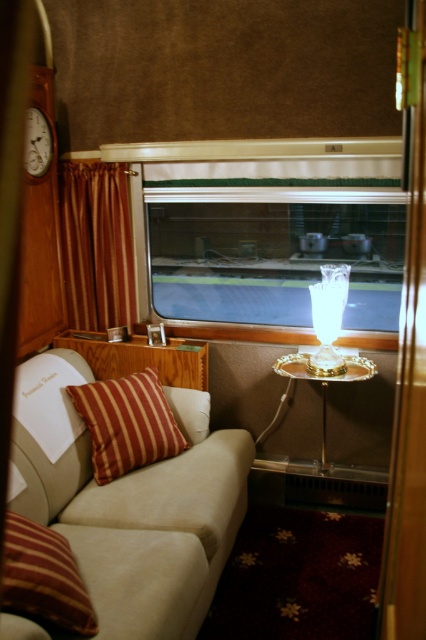
You are standing in the vintage train car interior and want to find the clear glass window at center. According to the coordinates provided, where should you look? Please provide the coordinates in the format of a point like point (273, 253).

The clear glass window at center is located at point (273, 253).

You are sitting on the beige fabric couch at center and want to reach the gold metallic side table at center to grab a book. Can you easily reach the side table from your current position?

The beige fabric couch at center is closer to the viewer than the gold metallic side table at center, so you would need to move forward to reach the side table since it is farther away.